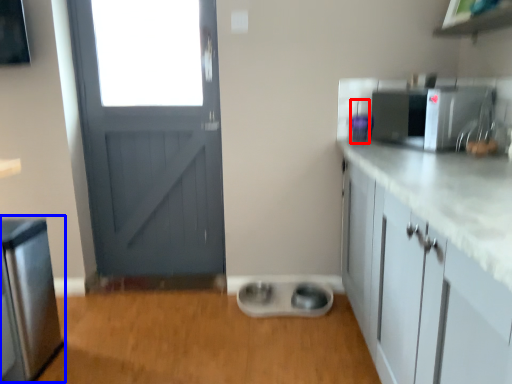
Question: Which object appears farthest to the camera in this image, appliance (highlighted by a red box) or appliance (highlighted by a blue box)?

Choices:
 (A) appliance
 (B) appliance

Answer: (A)